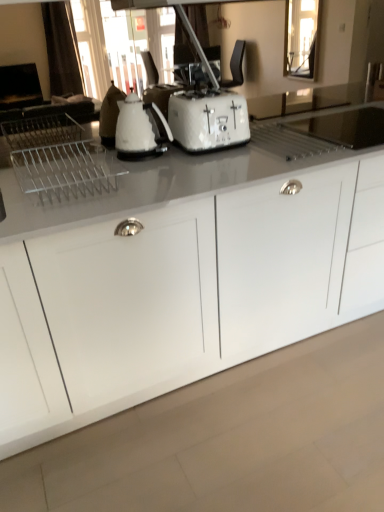
Where is `free space in front of white textured toaster at center`? free space in front of white textured toaster at center is located at coordinates (210, 163).